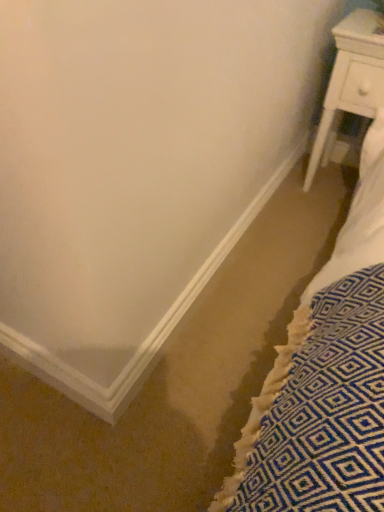
What is the approximate height of white wood nightstand at right?

white wood nightstand at right is 65.73 centimeters tall.

What do you see at coordinates (350, 82) in the screenshot?
I see `white wood nightstand at right` at bounding box center [350, 82].

Find the location of a particular element. white wood nightstand at right is located at coordinates (350, 82).

Where is `white wood nightstand at right`? The width and height of the screenshot is (384, 512). white wood nightstand at right is located at coordinates (350, 82).